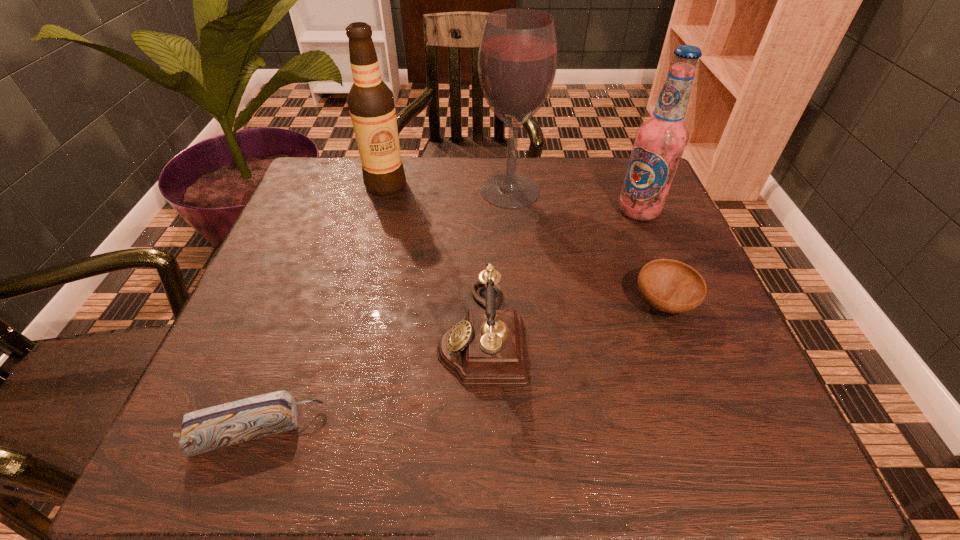
The height and width of the screenshot is (540, 960). What are the coordinates of `the second alcohol from left to right` in the screenshot? It's located at tap(517, 59).

Locate an element on the screen. The image size is (960, 540). the leftmost alcohol is located at coordinates (370, 101).

Identify the location of the rightmost alcohol. Image resolution: width=960 pixels, height=540 pixels. (659, 142).

The image size is (960, 540). What are the coordinates of `the fourth tallest object` in the screenshot? It's located at (487, 347).

Where is `bowl`? The image size is (960, 540). bowl is located at coordinates (671, 286).

Find the location of `the nearest object`. the nearest object is located at coordinates (219, 426).

Where is `vacant position located 0.230m on the right of the second alcohol from right to left`? This screenshot has width=960, height=540. vacant position located 0.230m on the right of the second alcohol from right to left is located at coordinates (631, 191).

The width and height of the screenshot is (960, 540). Identify the location of vacant region located 0.060m on the label of the leftmost alcohol. (379, 212).

Find the location of a particular element. vacant space located 0.150m on the back of the rightmost alcohol is located at coordinates (620, 166).

Image resolution: width=960 pixels, height=540 pixels. Find the location of `vacant space located on the dial of the telephone`. vacant space located on the dial of the telephone is located at coordinates (348, 332).